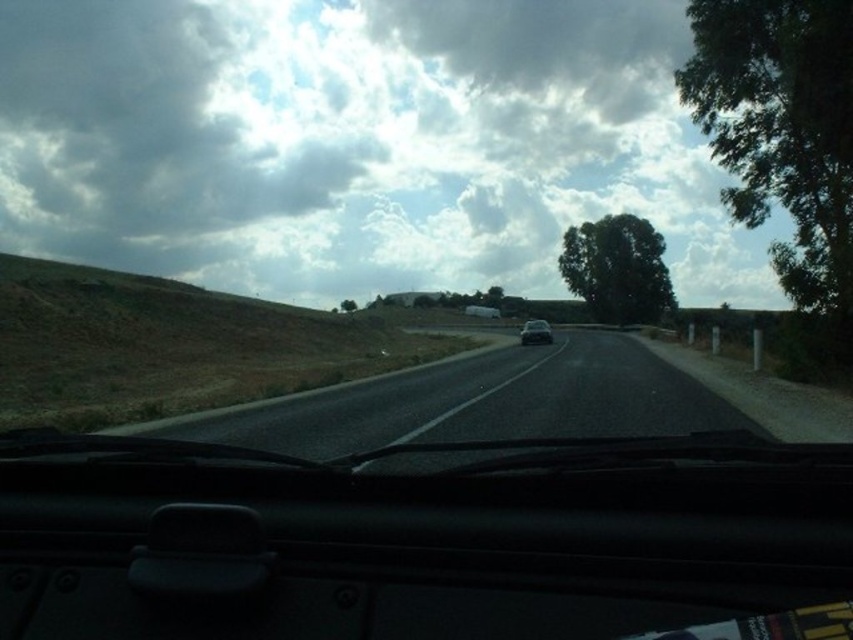
You are a passenger in the car and want to know where exactly the transparent glass windshield at center is located in the image. Can you describe its position using coordinates?

The transparent glass windshield at center is located at coordinates point (425,540).

You are driving a car and see the green leafy tree at right and the sleek silver sedan at center ahead on the road. Which object is taller?

The green leafy tree at right is much taller than the sleek silver sedan at center.

You are driving and want to know the position of the green leafy tree at right relative to the center of the windshield. Is it to the left or right of the center?

The green leafy tree at right is located at point 0.225 on the x axis, which is to the left of the center of the windshield.